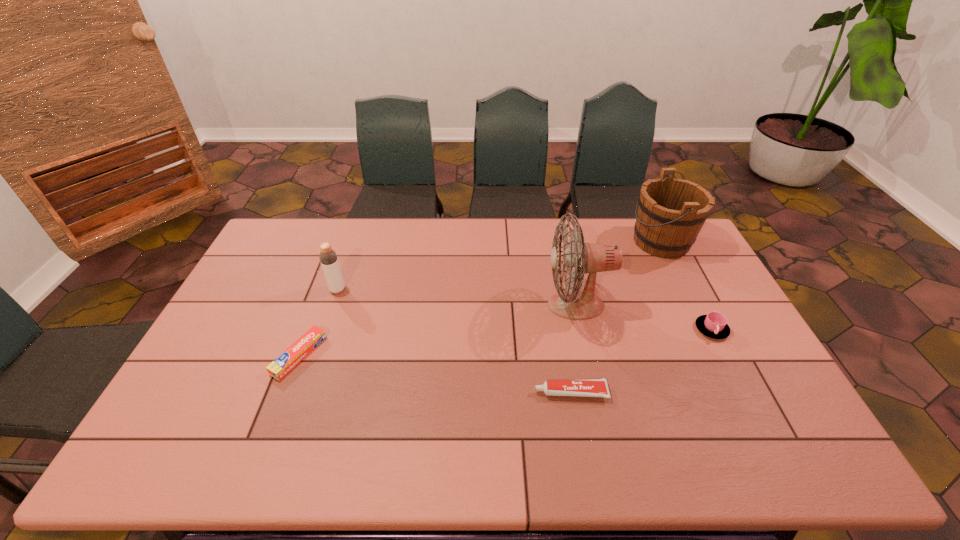
At what (x,y) coordinates should I click in order to perform the action: click on free space that satisfies the following two spatial constraints: 1. on the side with the handle of the cup; 2. at the nozzle of the taller toothpaste. Please return your answer as a coordinate pair (x, y). The width and height of the screenshot is (960, 540). Looking at the image, I should click on (744, 392).